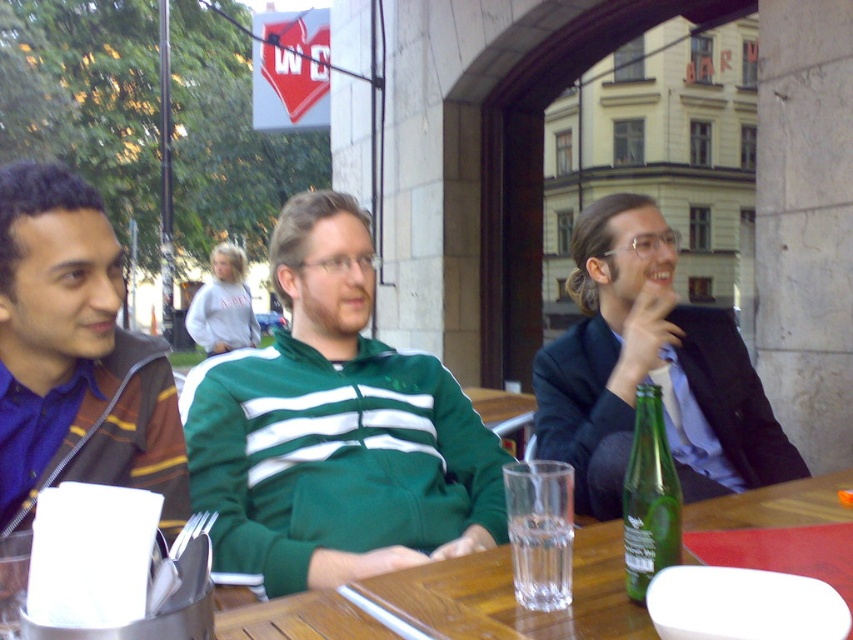
Question: Is green fabric jacket at center to the left of white fleece sweatshirt at center from the viewer's perspective?

Choices:
 (A) no
 (B) yes

Answer: (A)

Question: Does green fabric jacket at center come in front of wooden table at center?

Choices:
 (A) yes
 (B) no

Answer: (B)

Question: Is wooden table at center bigger than green glass bottle at center?

Choices:
 (A) no
 (B) yes

Answer: (B)

Question: Estimate the real-world distances between objects in this image. Which object is closer to the green fleece jacket at center?

Choices:
 (A) green glass bottle at center
 (B) blue striped shirt at left

Answer: (B)

Question: Which point is closer to the camera?

Choices:
 (A) green fabric jacket at center
 (B) green glass bottle at center

Answer: (B)

Question: Which point is closer to the camera?

Choices:
 (A) wooden table at center
 (B) green fleece jacket at center

Answer: (A)